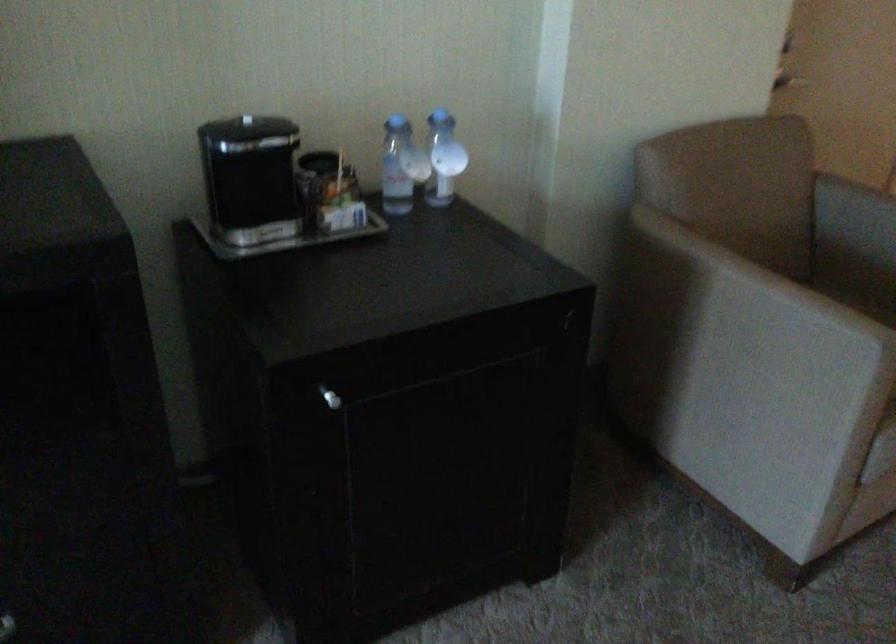
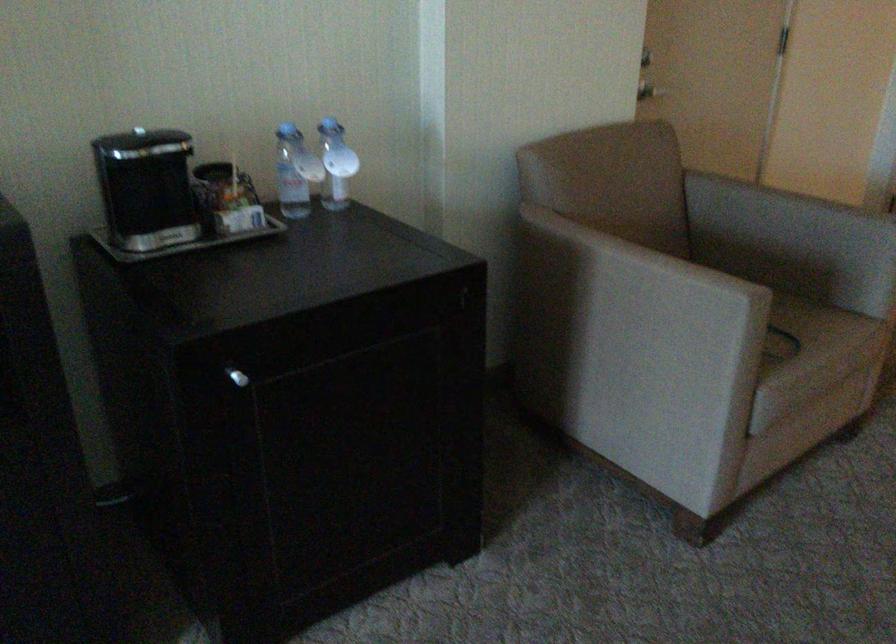
Locate, in the second image, the point that corresponds to point (444, 163) in the first image.

(336, 164)